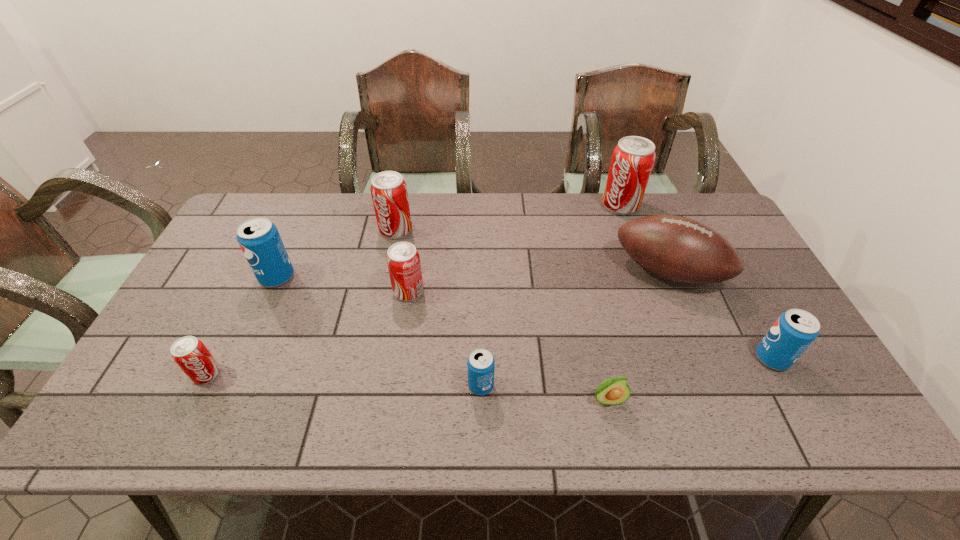
The width and height of the screenshot is (960, 540). In order to click on vacant area located on the right of the third farthest red soda can in this screenshot , I will do `click(491, 291)`.

The image size is (960, 540). Identify the location of blank area located 0.340m on the left of the second smallest blue soda can. (619, 359).

What are the coordinates of `vacant space situated on the right of the nearest red soda can` in the screenshot? It's located at (372, 374).

Find the location of a particular element. The image size is (960, 540). free space located on the left of the fifth object from left to right is located at coordinates (435, 386).

This screenshot has height=540, width=960. Find the location of `object positioned at the near edge`. object positioned at the near edge is located at coordinates (613, 391).

You are a GUI agent. You are given a task and a screenshot of the screen. Output one action in this format:
    pyautogui.click(x=<x>, y=<y>)
    Task: Click on the object that is at the left edge
    This screenshot has height=540, width=960.
    Given the screenshot: What is the action you would take?
    pyautogui.click(x=190, y=354)

Identify the location of football (American) located in the right edge section of the desktop. (678, 249).

The image size is (960, 540). Identify the location of soda can that is at the right edge. (794, 331).

Locate an element on the screen. Image resolution: width=960 pixels, height=540 pixels. vacant space at the far edge is located at coordinates (502, 224).

You are a GUI agent. You are given a task and a screenshot of the screen. Output one action in this format:
    pyautogui.click(x=<x>, y=<y>)
    Task: Click on the vacant space at the near edge of the desktop
    This screenshot has width=960, height=540.
    Given the screenshot: What is the action you would take?
    pyautogui.click(x=547, y=405)